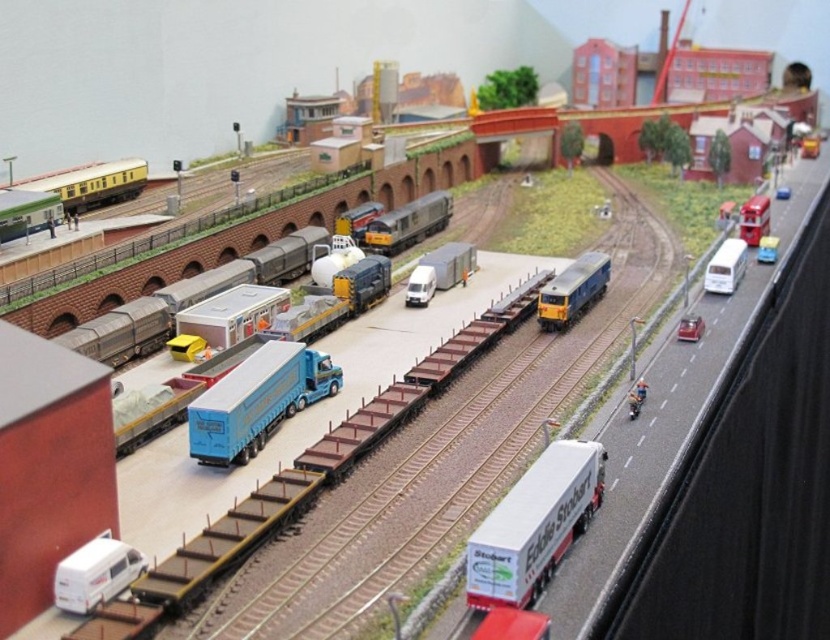
Can you confirm if white matte truck at center is smaller than shiny red car at right?

Incorrect, white matte truck at center is not smaller in size than shiny red car at right.

Does white matte truck at center appear on the left side of shiny red car at right?

Indeed, white matte truck at center is positioned on the left side of shiny red car at right.

The height and width of the screenshot is (640, 830). I want to click on white matte truck at center, so click(x=535, y=525).

Can you confirm if white matte truck at center is wider than yellow matte train car at upper left?

Yes, white matte truck at center is wider than yellow matte train car at upper left.

Does white matte truck at center come behind yellow matte train car at upper left?

No, white matte truck at center is closer to the viewer.

This screenshot has width=830, height=640. What are the coordinates of `white matte truck at center` in the screenshot? It's located at (535, 525).

Which of these two, yellow matte train car at upper left or shiny red car at right, stands shorter?

With less height is shiny red car at right.

Who is higher up, yellow matte train car at upper left or shiny red car at right?

yellow matte train car at upper left is higher up.

At what (x,y) coordinates should I click in order to perform the action: click on yellow matte train car at upper left. Please return your answer as a coordinate pair (x, y). Looking at the image, I should click on (91, 182).